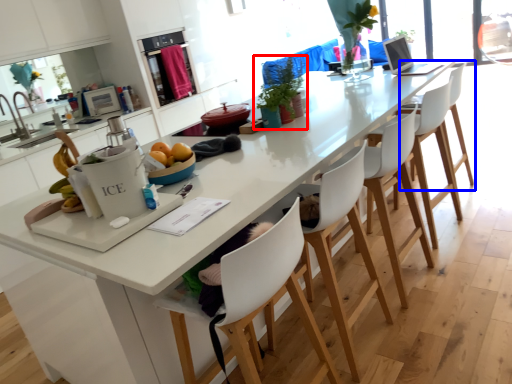
Question: Which object appears closest to the camera in this image, houseplant (highlighted by a red box) or chair (highlighted by a blue box)?

Choices:
 (A) houseplant
 (B) chair

Answer: (A)